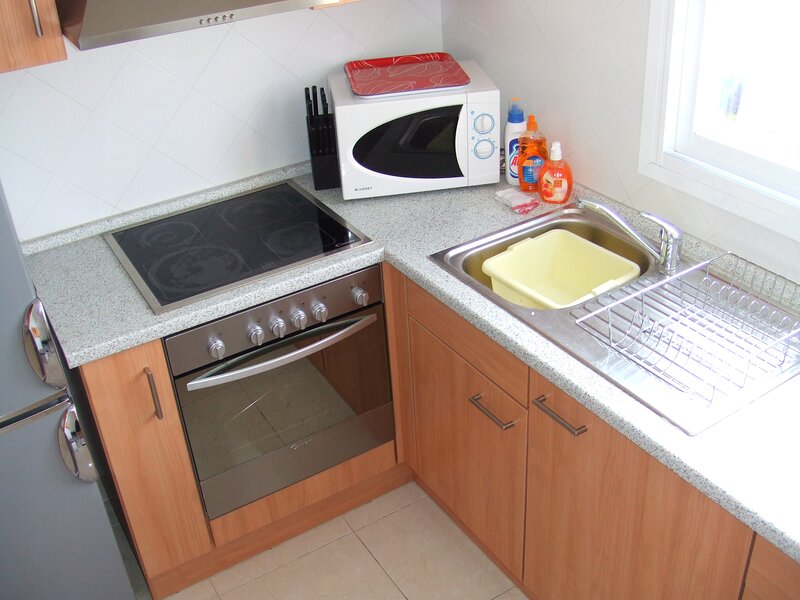
If there are any where to open cabinet under sink left present in the image, indicate their positions. Your answer should be formatted as a list of tuples, i.e. [(x1, y1), (x2, y2), ...], where each tuple contains the x and y coordinates of a point satisfying the conditions above.

[(490, 416)]